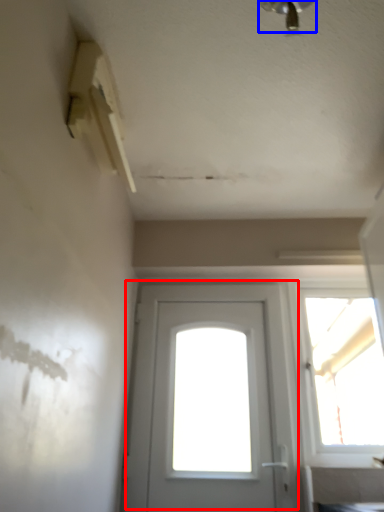
Question: Among these objects, which one is nearest to the camera, door (highlighted by a red box) or light fixture (highlighted by a blue box)?

Choices:
 (A) door
 (B) light fixture

Answer: (B)